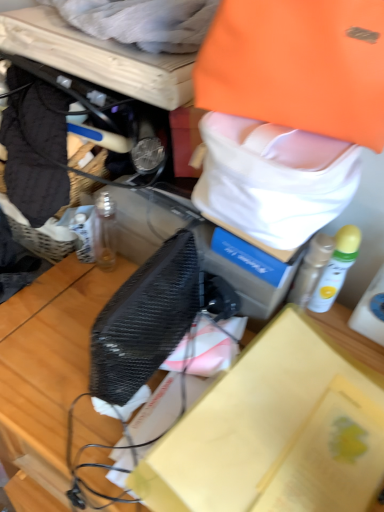
Identify the location of vacant space situated above orange fabric tote bag at upper right (from a real-world perspective). (278, 128).